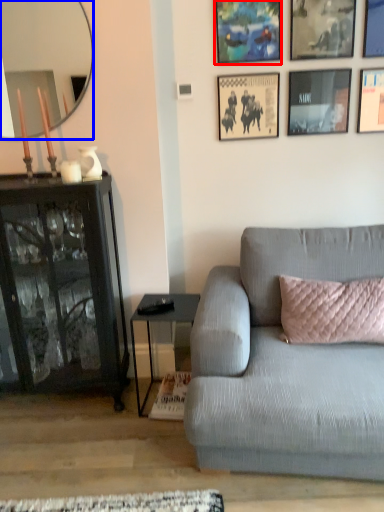
Question: Which object appears closest to the camera in this image, picture frame (highlighted by a red box) or mirror (highlighted by a blue box)?

Choices:
 (A) picture frame
 (B) mirror

Answer: (B)